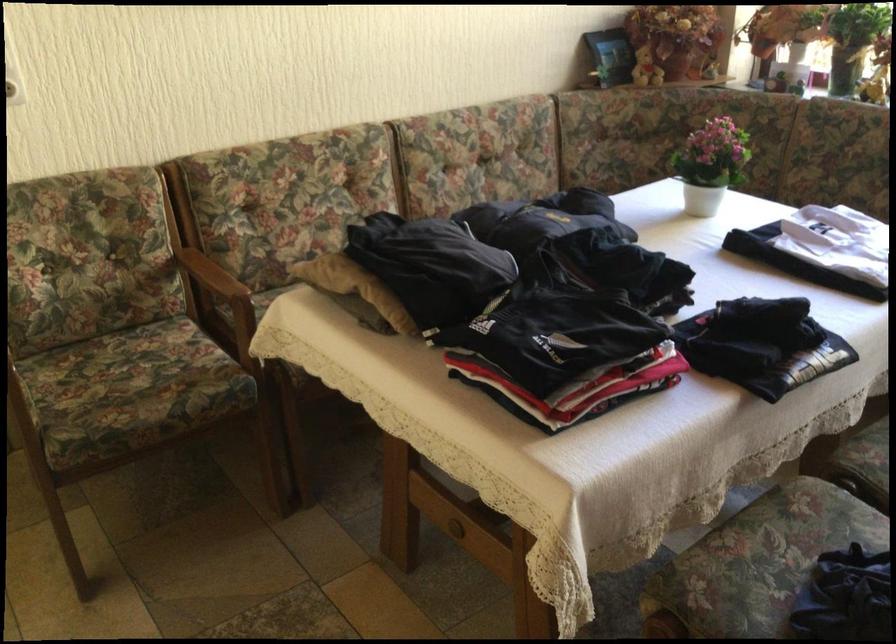
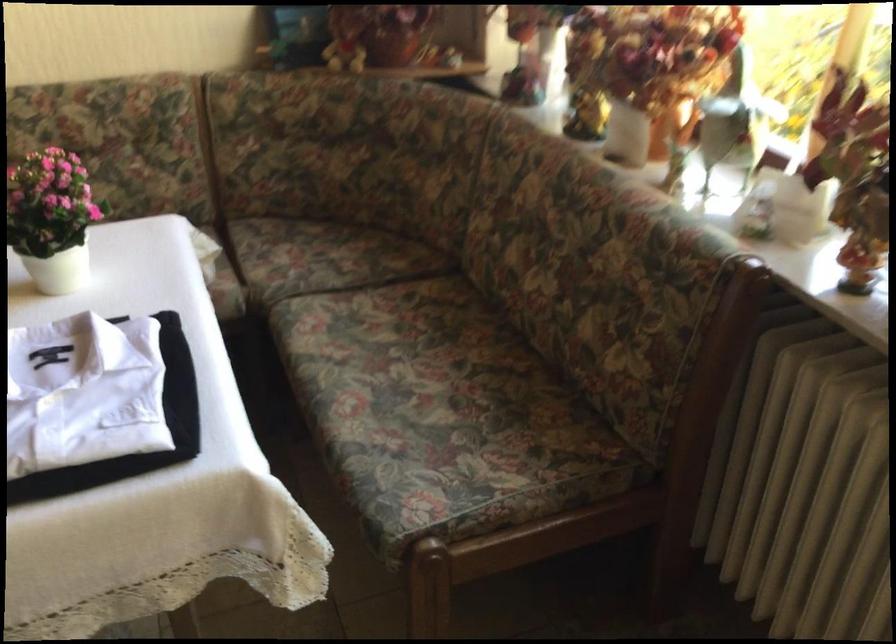
In a continuous first-person perspective shot, in which direction is the camera moving?

The cameraman walked toward right, forward.